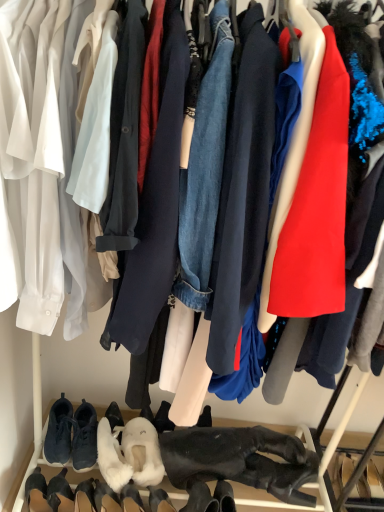
In order to face white fluffy slippers at lower center, arranged as the fourth footwear when viewed from the right, should I rotate leftwards or rightwards?

Rotate left and turn 10.409 degrees.

Describe the element at coordinates (240, 460) in the screenshot. I see `black leather boots at lower center, which is counted as the 8th footwear, starting from the left` at that location.

The height and width of the screenshot is (512, 384). What do you see at coordinates (106, 498) in the screenshot? I see `white fluffy boot at lower center, arranged as the 3th footwear when viewed from the right` at bounding box center [106, 498].

What do you see at coordinates (84, 437) in the screenshot? I see `dark gray suede sneakers at lower left, positioned as the 4th footwear in left-to-right order` at bounding box center [84, 437].

Locate an element on the screen. This screenshot has height=512, width=384. white suede boot at lower left, the 6th footwear from the right is located at coordinates (60, 493).

Is point (41, 509) closer to viewer compared to point (80, 450)?

Yes, it is in front of point (80, 450).

How much distance is there between black suede boot at lower left, which is the eighth footwear in right-to-left order, and dark gray suede sneakers at lower left, the fifth footwear positioned from the right?

The distance of black suede boot at lower left, which is the eighth footwear in right-to-left order, from dark gray suede sneakers at lower left, the fifth footwear positioned from the right, is 6.68 inches.

From the image's perspective, between black suede boot at lower left, which is the eighth footwear in right-to-left order, and dark gray suede sneakers at lower left, the fifth footwear positioned from the right, which one is located above?

dark gray suede sneakers at lower left, the fifth footwear positioned from the right, from the image's perspective.

Which footwear is the 5th one when counting from the back of the black suede boot at lower left, which is the eighth footwear in right-to-left order? Please provide its 2D coordinates.

[(84, 437)]

From the image's perspective, does dark gray suede sneakers at lower left, positioned as the 4th footwear in left-to-right order, appear lower than white fluffy slippers at lower center, the second footwear viewed from the right?

Actually, dark gray suede sneakers at lower left, positioned as the 4th footwear in left-to-right order, appears above white fluffy slippers at lower center, the second footwear viewed from the right, in the image.

How many degrees apart are the facing directions of dark gray suede sneakers at lower left, the fifth footwear positioned from the right, and white fluffy slippers at lower center, which is the 7th footwear from left to right?

dark gray suede sneakers at lower left, the fifth footwear positioned from the right, and white fluffy slippers at lower center, which is the 7th footwear from left to right, are facing 5.21 degrees away from each other.

Which footwear is the 3rd one when counting from the right side of the dark gray suede sneakers at lower left, the fifth footwear positioned from the right? Please provide its 2D coordinates.

[(142, 451)]

Looking at this image, is dark gray suede sneakers at lower left, positioned as the 4th footwear in left-to-right order, not within white fluffy slippers at lower center, which is the 7th footwear from left to right?

dark gray suede sneakers at lower left, positioned as the 4th footwear in left-to-right order, is positioned outside white fluffy slippers at lower center, which is the 7th footwear from left to right.

Are white fluffy slippers at lower center, the second footwear viewed from the right, and black suede boot at lower left, the first footwear when ordered from left to right, making contact?

No.

Consider the image. Which is correct: white fluffy slippers at lower center, the second footwear viewed from the right, is inside black suede boot at lower left, the first footwear when ordered from left to right, or outside of it?

white fluffy slippers at lower center, the second footwear viewed from the right, exists outside the volume of black suede boot at lower left, the first footwear when ordered from left to right.

Looking at this image, considering the sizes of objects white fluffy slippers at lower center, the second footwear viewed from the right, and black suede boot at lower left, which is the eighth footwear in right-to-left order, in the image provided, who is bigger, white fluffy slippers at lower center, the second footwear viewed from the right, or black suede boot at lower left, which is the eighth footwear in right-to-left order,?

With larger size is white fluffy slippers at lower center, the second footwear viewed from the right.

Measure the distance between white fluffy slippers at lower center, the second footwear viewed from the right, and black leather boots at lower center, the 1th footwear from the right.

white fluffy slippers at lower center, the second footwear viewed from the right, is 8.49 inches away from black leather boots at lower center, the 1th footwear from the right.

Which of these two, white fluffy slippers at lower center, the second footwear viewed from the right, or black leather boots at lower center, the 1th footwear from the right, is bigger?

With larger size is black leather boots at lower center, the 1th footwear from the right.

From the image's perspective, between white fluffy slippers at lower center, which is the 7th footwear from left to right, and black leather boots at lower center, the 1th footwear from the right, which one is located above?

white fluffy slippers at lower center, which is the 7th footwear from left to right, is shown above in the image.

You are a GUI agent. You are given a task and a screenshot of the screen. Output one action in this format:
    pyautogui.click(x=<x>, y=<y>)
    Task: Click on the 2nd footwear above the white fluffy slippers at lower center, the second footwear viewed from the right (from a real-world perspective)
    
    Given the screenshot: What is the action you would take?
    click(x=240, y=460)

Considering the relative positions of white fluffy boot at lower center, arranged as the 3th footwear when viewed from the right, and dark blue suede sneakers at lower left, which appears as the seventh footwear when viewed from the right, in the image provided, is white fluffy boot at lower center, arranged as the 3th footwear when viewed from the right, to the left of dark blue suede sneakers at lower left, which appears as the seventh footwear when viewed from the right, from the viewer's perspective?

Incorrect, white fluffy boot at lower center, arranged as the 3th footwear when viewed from the right, is not on the left side of dark blue suede sneakers at lower left, which appears as the seventh footwear when viewed from the right.

How far apart are white fluffy boot at lower center, arranged as the 3th footwear when viewed from the right, and dark blue suede sneakers at lower left, which appears as the seventh footwear when viewed from the right?

white fluffy boot at lower center, arranged as the 3th footwear when viewed from the right, is 8.52 inches from dark blue suede sneakers at lower left, which appears as the seventh footwear when viewed from the right.

Is white fluffy boot at lower center, the sixth footwear from the left, positioned beyond the bounds of dark blue suede sneakers at lower left, which is counted as the second footwear, starting from the left?

Yes, white fluffy boot at lower center, the sixth footwear from the left, is located beyond the bounds of dark blue suede sneakers at lower left, which is counted as the second footwear, starting from the left.

Locate an element on the screen. This screenshot has width=384, height=512. the 7th footwear below when counting from the dark blue suede sneakers at lower left, which is counted as the second footwear, starting from the left (from the image's perspective) is located at coordinates (106, 498).

Considering the positions of objects white fluffy slippers at lower center, arranged as the fourth footwear when viewed from the right, and dark blue suede sneakers at lower left, which appears as the seventh footwear when viewed from the right, in the image provided, who is behind, white fluffy slippers at lower center, arranged as the fourth footwear when viewed from the right, or dark blue suede sneakers at lower left, which appears as the seventh footwear when viewed from the right,?

dark blue suede sneakers at lower left, which appears as the seventh footwear when viewed from the right, is more distant.

Is white fluffy slippers at lower center, the fifth footwear when ordered from left to right, smaller than dark blue suede sneakers at lower left, which is counted as the second footwear, starting from the left?

No, white fluffy slippers at lower center, the fifth footwear when ordered from left to right, is not smaller than dark blue suede sneakers at lower left, which is counted as the second footwear, starting from the left.

From a real-world perspective, is white fluffy slippers at lower center, arranged as the fourth footwear when viewed from the right, located beneath dark blue suede sneakers at lower left, which appears as the seventh footwear when viewed from the right?

Yes, from a real-world perspective, white fluffy slippers at lower center, arranged as the fourth footwear when viewed from the right, is beneath dark blue suede sneakers at lower left, which appears as the seventh footwear when viewed from the right.

From the image's perspective, between white fluffy slippers at lower center, arranged as the fourth footwear when viewed from the right, and dark blue suede sneakers at lower left, which is counted as the second footwear, starting from the left, which one is located above?

dark blue suede sneakers at lower left, which is counted as the second footwear, starting from the left, appears higher in the image.

Does point (105, 475) lie behind point (25, 489)?

Yes, it is behind point (25, 489).

Is white fluffy slippers at lower center, arranged as the fourth footwear when viewed from the right, positioned with its back to black suede boot at lower left, the first footwear when ordered from left to right?

No.

Does white fluffy slippers at lower center, arranged as the fourth footwear when viewed from the right, have a larger size compared to black suede boot at lower left, the first footwear when ordered from left to right?

Yes.

From the picture: Is white fluffy slippers at lower center, the fifth footwear when ordered from left to right, touching black suede boot at lower left, which is the eighth footwear in right-to-left order?

No, white fluffy slippers at lower center, the fifth footwear when ordered from left to right, is not in contact with black suede boot at lower left, which is the eighth footwear in right-to-left order.

From a real-world perspective, count 6th footwears downward from the dark gray suede sneakers at lower left, the fifth footwear positioned from the right, and point to it. Please provide its 2D coordinates.

[(37, 492)]

Find the location of `footwear that is the 1st object located in front of the dark gray suede sneakers at lower left, the fifth footwear positioned from the right`. footwear that is the 1st object located in front of the dark gray suede sneakers at lower left, the fifth footwear positioned from the right is located at coordinates (142, 451).

From the image, which object appears to be farther from black suede boot at lower left, the first footwear when ordered from left to right, dark blue suede sneakers at lower left, which appears as the seventh footwear when viewed from the right, or white fluffy slippers at lower center, the fifth footwear when ordered from left to right?

white fluffy slippers at lower center, the fifth footwear when ordered from left to right, is further to black suede boot at lower left, the first footwear when ordered from left to right.

Looking at the image, which one is located further to black leather boots at lower center, the 1th footwear from the right, black suede boot at lower left, the first footwear when ordered from left to right, or white fluffy slippers at lower center, the fifth footwear when ordered from left to right?

black suede boot at lower left, the first footwear when ordered from left to right, lies further to black leather boots at lower center, the 1th footwear from the right, than the other object.

When comparing their distances from white suede boot at lower left, the 6th footwear from the right, does white fluffy slippers at lower center, the second footwear viewed from the right, or dark blue suede sneakers at lower left, which is counted as the second footwear, starting from the left, seem closer?

The object closer to white suede boot at lower left, the 6th footwear from the right, is dark blue suede sneakers at lower left, which is counted as the second footwear, starting from the left.

Looking at the image, which one is located closer to white suede boot at lower left, the 6th footwear from the right, dark blue suede sneakers at lower left, which is counted as the second footwear, starting from the left, or black leather boots at lower center, which is counted as the 8th footwear, starting from the left?

The object closer to white suede boot at lower left, the 6th footwear from the right, is dark blue suede sneakers at lower left, which is counted as the second footwear, starting from the left.

Looking at the image, which one is located closer to dark blue suede sneakers at lower left, which is counted as the second footwear, starting from the left, black leather boots at lower center, which is counted as the 8th footwear, starting from the left, or dark gray suede sneakers at lower left, the fifth footwear positioned from the right?

dark gray suede sneakers at lower left, the fifth footwear positioned from the right, is positioned closer to the anchor dark blue suede sneakers at lower left, which is counted as the second footwear, starting from the left.

Considering their positions, is black leather boots at lower center, which is counted as the 8th footwear, starting from the left, positioned closer to black suede boot at lower left, which is the eighth footwear in right-to-left order, than white fluffy slippers at lower center, the second footwear viewed from the right?

Based on the image, white fluffy slippers at lower center, the second footwear viewed from the right, appears to be nearer to black suede boot at lower left, which is the eighth footwear in right-to-left order.

Looking at the image, which one is located further to black suede boot at lower left, which is the eighth footwear in right-to-left order, dark blue suede sneakers at lower left, which is counted as the second footwear, starting from the left, or white suede boot at lower left, the third footwear from the left?

dark blue suede sneakers at lower left, which is counted as the second footwear, starting from the left, is further to black suede boot at lower left, which is the eighth footwear in right-to-left order.

From the image, which object appears to be farther from white suede boot at lower left, the 6th footwear from the right, white fluffy slippers at lower center, the fifth footwear when ordered from left to right, or dark blue suede sneakers at lower left, which appears as the seventh footwear when viewed from the right?

white fluffy slippers at lower center, the fifth footwear when ordered from left to right, lies further to white suede boot at lower left, the 6th footwear from the right, than the other object.

In order to click on footwear located between white fluffy boot at lower center, the sixth footwear from the left, and black leather boots at lower center, which is counted as the 8th footwear, starting from the left, in the left-right direction in this screenshot , I will do `click(142, 451)`.